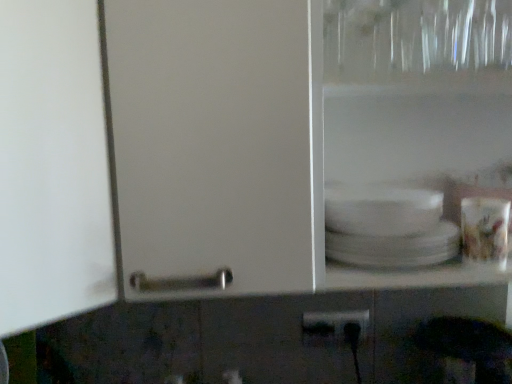
Question: Considering the relative positions of matte ceramic cup at right and black plastic power plugs and sockets at lower center in the image provided, is matte ceramic cup at right behind black plastic power plugs and sockets at lower center?

Choices:
 (A) no
 (B) yes

Answer: (A)

Question: Is matte ceramic cup at right smaller than black plastic power plugs and sockets at lower center?

Choices:
 (A) yes
 (B) no

Answer: (B)

Question: Is matte ceramic cup at right aimed at black plastic power plugs and sockets at lower center?

Choices:
 (A) yes
 (B) no

Answer: (B)

Question: Considering the relative sizes of matte ceramic cup at right and black plastic power plugs and sockets at lower center in the image provided, is matte ceramic cup at right shorter than black plastic power plugs and sockets at lower center?

Choices:
 (A) yes
 (B) no

Answer: (B)

Question: Can you confirm if matte ceramic cup at right is bigger than black plastic power plugs and sockets at lower center?

Choices:
 (A) no
 (B) yes

Answer: (B)

Question: From a real-world perspective, is matte ceramic cup at right physically above black plastic power plugs and sockets at lower center?

Choices:
 (A) yes
 (B) no

Answer: (A)

Question: From the image's perspective, is black plastic power plugs and sockets at lower center on top of matte ceramic cup at right?

Choices:
 (A) no
 (B) yes

Answer: (A)

Question: Could matte ceramic cup at right be considered to be inside black plastic power plugs and sockets at lower center?

Choices:
 (A) no
 (B) yes

Answer: (A)

Question: Is the position of black plastic power plugs and sockets at lower center less distant than that of matte ceramic cup at right?

Choices:
 (A) no
 (B) yes

Answer: (A)

Question: Can you confirm if black plastic power plugs and sockets at lower center is positioned to the left of matte ceramic cup at right?

Choices:
 (A) yes
 (B) no

Answer: (A)

Question: Is black plastic power plugs and sockets at lower center directly adjacent to matte ceramic cup at right?

Choices:
 (A) yes
 (B) no

Answer: (B)

Question: Is the position of black plastic power plugs and sockets at lower center more distant than that of matte ceramic cup at right?

Choices:
 (A) no
 (B) yes

Answer: (B)

Question: Is matte ceramic cup at right spatially inside black plastic power plugs and sockets at lower center, or outside of it?

Choices:
 (A) inside
 (B) outside

Answer: (B)